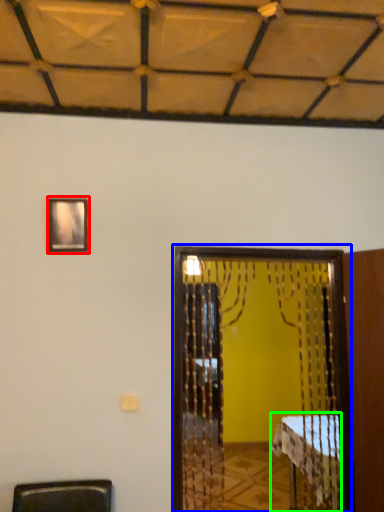
Question: Estimate the real-world distances between objects in this image. Which object is closer to picture frame (highlighted by a red box), screen door (highlighted by a blue box) or table (highlighted by a green box)?

Choices:
 (A) screen door
 (B) table

Answer: (A)